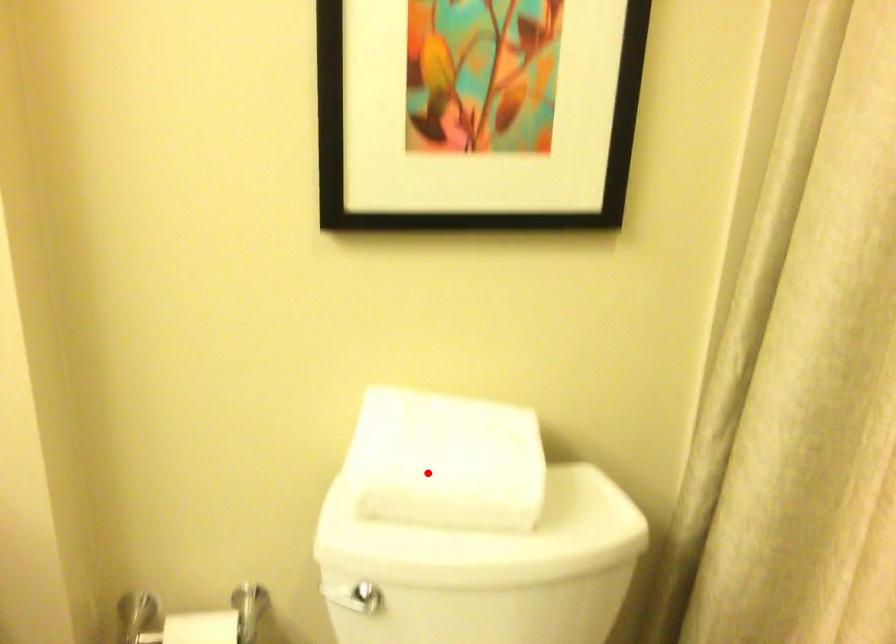
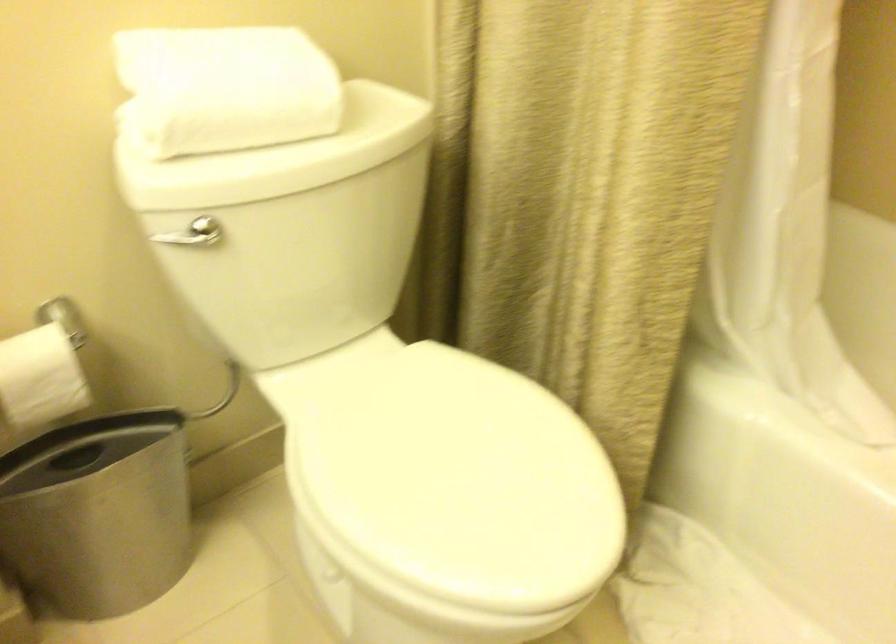
Question: I am providing you with two images of the same scene from different viewpoints. A red point is marked on the first image. At the location where the point appears in image 1, is it still visible in image 2?

Choices:
 (A) Yes
 (B) No

Answer: (A)